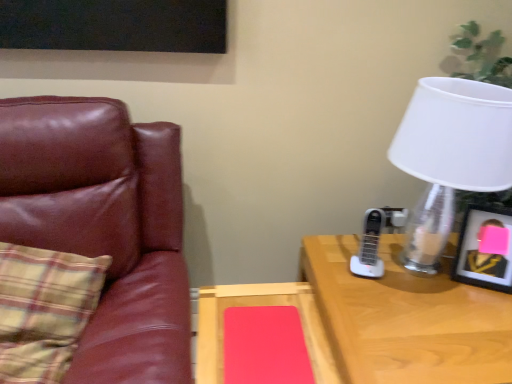
Question: Based on their sizes in the image, would you say white matte lampshade at upper right is bigger or smaller than metallic silver picture frame at right?

Choices:
 (A) small
 (B) big

Answer: (B)

Question: Would you say white matte lampshade at upper right is to the left or to the right of metallic silver picture frame at right in the picture?

Choices:
 (A) left
 (B) right

Answer: (A)

Question: Estimate the real-world distances between objects in this image. Which object is farther from the matte wood table at center?

Choices:
 (A) wooden desk at right
 (B) metallic silver picture frame at right
 (C) plaid fabric pillow at left
 (D) leather couch at left
 (E) white matte lampshade at upper right

Answer: (B)

Question: Considering the real-world distances, which object is closest to the metallic silver picture frame at right?

Choices:
 (A) wooden desk at right
 (B) plaid fabric pillow at left
 (C) matte wood table at center
 (D) white matte lampshade at upper right
 (E) leather couch at left

Answer: (D)